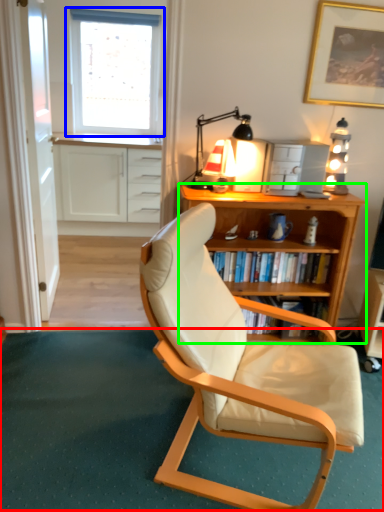
Question: Which is nearer to the plain (highlighted by a red box)? window (highlighted by a blue box) or desk (highlighted by a green box).

Choices:
 (A) window
 (B) desk

Answer: (B)